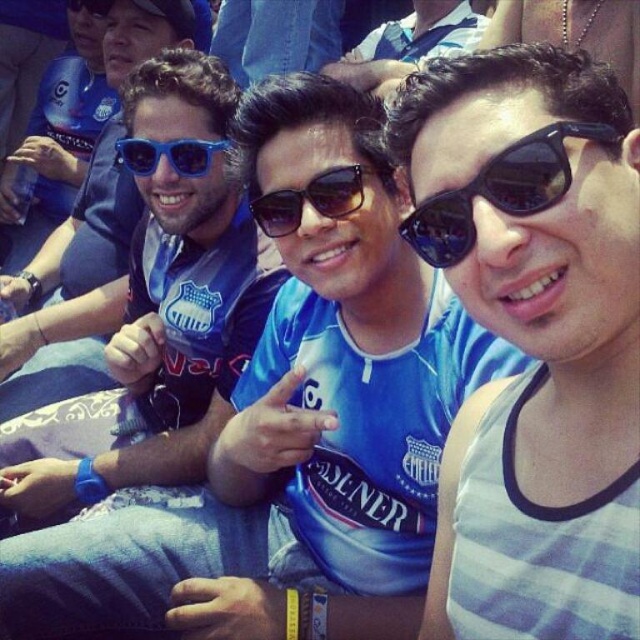
Where is `black reflective sunglasses at upper right`? black reflective sunglasses at upper right is located at coordinates (500, 189).

Does black reflective sunglasses at upper right appear on the right side of blue plastic sunglasses at center?

Correct, you'll find black reflective sunglasses at upper right to the right of blue plastic sunglasses at center.

Who is more distant from viewer, (497,205) or (204,172)?

Positioned behind is point (204,172).

At what (x,y) coordinates should I click in order to perform the action: click on black reflective sunglasses at upper right. Please return your answer as a coordinate pair (x, y). Looking at the image, I should click on click(500, 189).

Where is `matte blue jersey at center`? matte blue jersey at center is located at coordinates (160, 349).

Can you confirm if matte blue jersey at center is taller than sunglasses at center?

Yes.

In the scene shown: Who is higher up, matte blue jersey at center or sunglasses at center?

Positioned higher is sunglasses at center.

The width and height of the screenshot is (640, 640). I want to click on matte blue jersey at center, so click(160, 349).